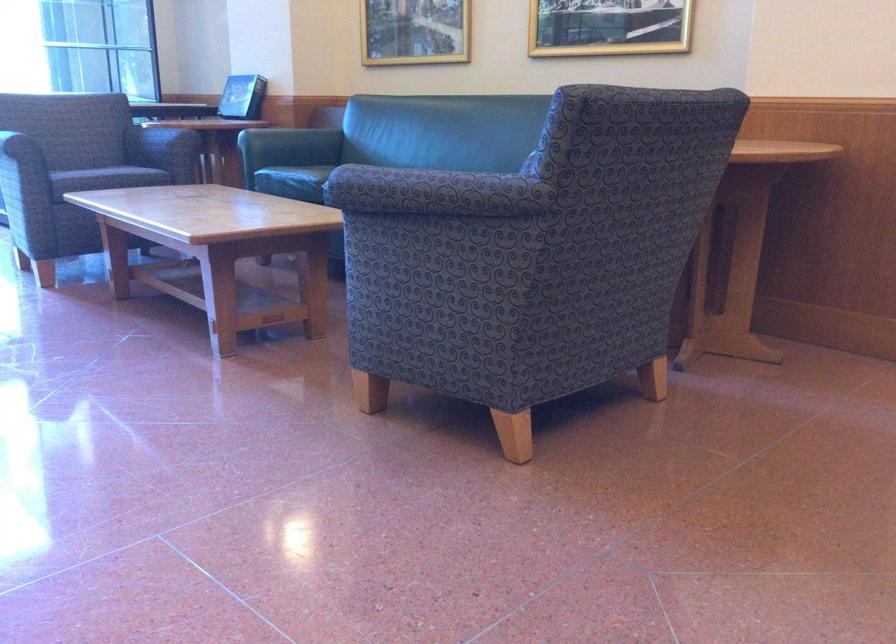
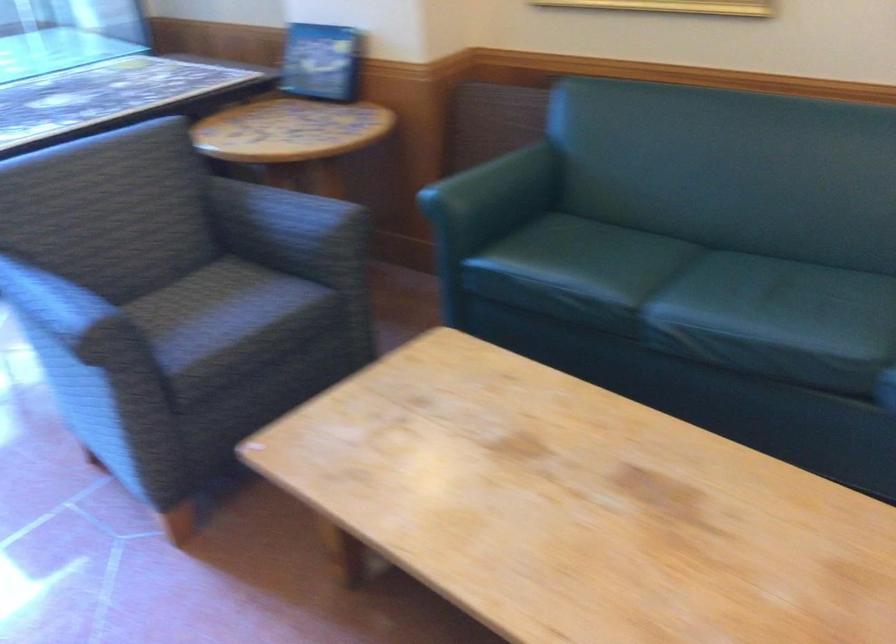
Find the pixel in the second image that matches [152,126] in the first image.

(287, 211)